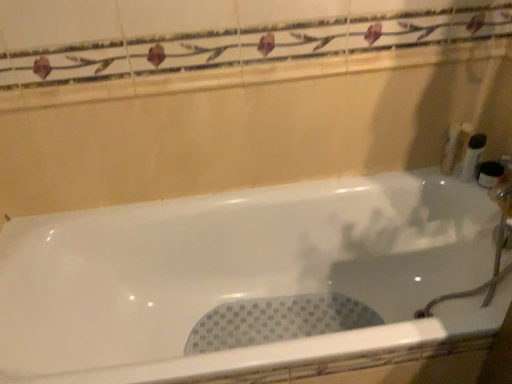
I want to click on vacant area that is in front of white plastic bottle at right, placed as the 1th toiletry when sorted from left to right, so click(x=468, y=188).